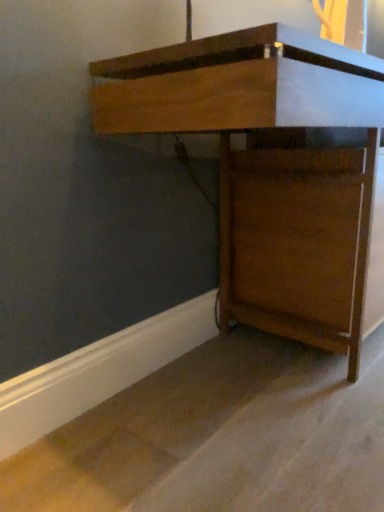
Where is `wooden desk at center`? wooden desk at center is located at coordinates (269, 166).

The height and width of the screenshot is (512, 384). What do you see at coordinates (269, 166) in the screenshot?
I see `wooden desk at center` at bounding box center [269, 166].

You are a GUI agent. You are given a task and a screenshot of the screen. Output one action in this format:
    pyautogui.click(x=<x>, y=<y>)
    Task: Click on the brown wood cabinet at lower right
    The image size is (384, 512).
    Given the screenshot: What is the action you would take?
    pyautogui.click(x=219, y=437)

The image size is (384, 512). What do you see at coordinates (219, 437) in the screenshot?
I see `brown wood cabinet at lower right` at bounding box center [219, 437].

Looking at this image, what is the approximate height of brown wood cabinet at lower right?

brown wood cabinet at lower right is 9.30 centimeters tall.

Image resolution: width=384 pixels, height=512 pixels. I want to click on wooden desk at center, so click(x=269, y=166).

Which object is positioned more to the left, wooden desk at center or brown wood cabinet at lower right?

brown wood cabinet at lower right is more to the left.

Who is more distant, wooden desk at center or brown wood cabinet at lower right?

wooden desk at center.

Which is further, (195, 91) or (208, 431)?

Positioned behind is point (208, 431).

From the image's perspective, is wooden desk at center under brown wood cabinet at lower right?

No, from the image's perspective, wooden desk at center is not below brown wood cabinet at lower right.

From a real-world perspective, is wooden desk at center positioned above or below brown wood cabinet at lower right?

From a real-world perspective, wooden desk at center is physically above brown wood cabinet at lower right.

Which object is wider, wooden desk at center or brown wood cabinet at lower right?

brown wood cabinet at lower right.

Does wooden desk at center have a lesser height compared to brown wood cabinet at lower right?

No, wooden desk at center is not shorter than brown wood cabinet at lower right.

Which of these two, wooden desk at center or brown wood cabinet at lower right, is smaller?

With smaller size is brown wood cabinet at lower right.

Would you say brown wood cabinet at lower right is part of wooden desk at center's contents?

No, brown wood cabinet at lower right is not a part of wooden desk at center.

Is wooden desk at center beside brown wood cabinet at lower right?

No, wooden desk at center is not with brown wood cabinet at lower right.

Is wooden desk at center aimed at brown wood cabinet at lower right?

No, wooden desk at center is not oriented towards brown wood cabinet at lower right.

Measure the distance from wooden desk at center to brown wood cabinet at lower right.

wooden desk at center and brown wood cabinet at lower right are 18.34 inches apart from each other.

Find the location of a particular element. concrete located on the left of wooden desk at center is located at coordinates (219, 437).

Is brown wood cabinet at lower right to the left of wooden desk at center from the viewer's perspective?

Yes.

Between brown wood cabinet at lower right and wooden desk at center, which one is positioned in front?

brown wood cabinet at lower right is closer to the camera.

Between point (281, 465) and point (277, 97), which one is positioned behind?

The point (281, 465) is farther from the camera.

From the image's perspective, is brown wood cabinet at lower right above or below wooden desk at center?

brown wood cabinet at lower right is situated lower than wooden desk at center in the image.

From a real-world perspective, relative to wooden desk at center, is brown wood cabinet at lower right vertically above or below?

Clearly, from a real-world perspective, brown wood cabinet at lower right is below wooden desk at center.

Which of these two, brown wood cabinet at lower right or wooden desk at center, is wider?

brown wood cabinet at lower right.

Considering the sizes of objects brown wood cabinet at lower right and wooden desk at center in the image provided, who is shorter, brown wood cabinet at lower right or wooden desk at center?

Standing shorter between the two is brown wood cabinet at lower right.

Looking at this image, considering the relative sizes of brown wood cabinet at lower right and wooden desk at center in the image provided, is brown wood cabinet at lower right bigger than wooden desk at center?

Actually, brown wood cabinet at lower right might be smaller than wooden desk at center.

Which is correct: brown wood cabinet at lower right is inside wooden desk at center, or outside of it?

brown wood cabinet at lower right lies outside wooden desk at center.

Is brown wood cabinet at lower right not near wooden desk at center?

No.

Is brown wood cabinet at lower right looking in the opposite direction of wooden desk at center?

brown wood cabinet at lower right does not have its back to wooden desk at center.

How different are the orientations of brown wood cabinet at lower right and wooden desk at center in degrees?

There is a 1.02-degree angle between the facing directions of brown wood cabinet at lower right and wooden desk at center.

Where is `concrete below the wooden desk at center (from the image's perspective)`? concrete below the wooden desk at center (from the image's perspective) is located at coordinates (219, 437).

I want to click on furniture to the right of brown wood cabinet at lower right, so click(269, 166).

Where is `furniture behind the brown wood cabinet at lower right`? The height and width of the screenshot is (512, 384). furniture behind the brown wood cabinet at lower right is located at coordinates (269, 166).